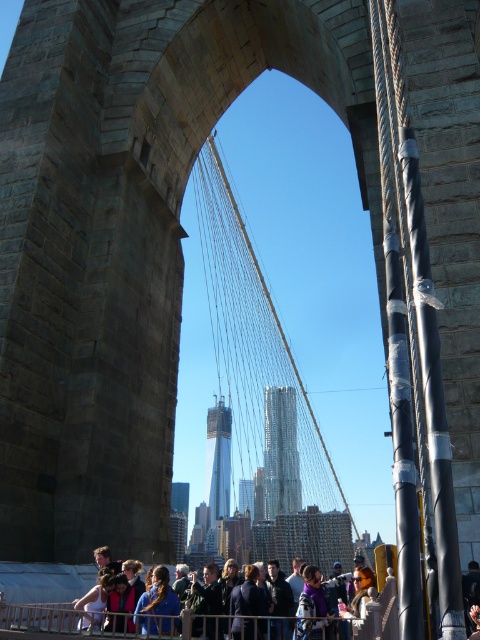
You are a photographer standing at the base of the Brooklyn Bridge arch. You notice the blue fabric crowd at lower center and the dark blue jacket at center in your viewfinder. Which object occupies more horizontal space in the photo?

The blue fabric crowd at lower center occupies more horizontal space in the photo because its width is larger than that of the dark blue jacket at center.

You are a photographer standing under the Brooklyn Bridge arch, aiming to capture the purple fabric at center and dark gray jacket at center in your shot. Based on their sizes in the image, which object would you focus on first if you want to ensure both are in focus?

The purple fabric at center has a smaller size compared to dark gray jacket at center. Since the purple fabric is smaller, it might be positioned farther away, so focusing on the larger dark gray jacket at center could help ensure both are in focus as the depth of field would cover both distances.

You are a photographer standing under the Brooklyn Bridge arch, looking up at the cables and city skyline. You notice a purple fabric at center and a dark gray jacket at center. Which object is shorter in height?

The purple fabric at center is not as tall as the dark gray jacket at center, so the purple fabric at center is shorter in height.